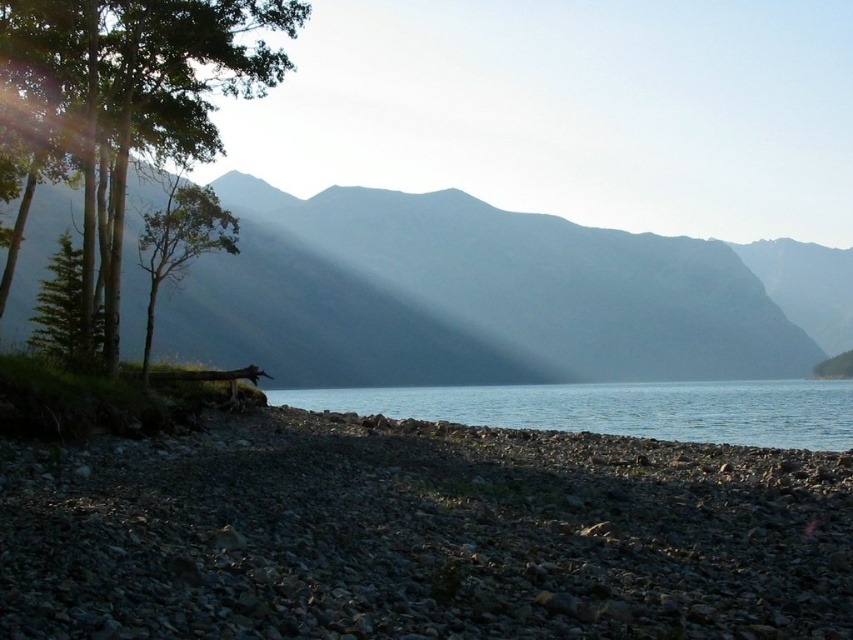
You are standing at the lakeside and want to take a photo of the smooth gray mountain at center. If your camera can focus on objects up to 300 feet away, will it be able to capture the mountain clearly?

The smooth gray mountain at center is 342.87 feet away from the camera, which is beyond the camera maximum focusing distance of 300 feet. Therefore, the camera cannot capture the mountain clearly.

You are standing at the lakeside and want to take a photo of the green matte tree at left and the smooth gray mountain at center. Which object will appear smaller in the photo?

The green matte tree at left will appear smaller in the photo because it is positioned behind the smooth gray mountain at center, making it farther away from the camera and thus appearing smaller.